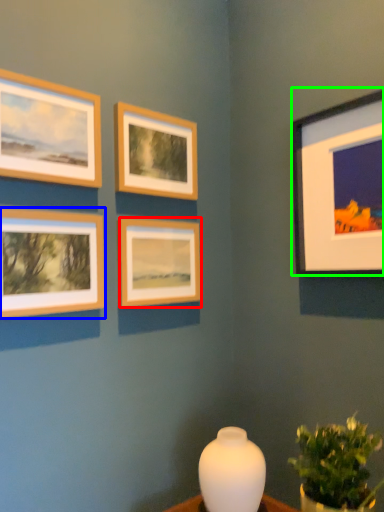
Question: Which is farther away from picture frame (highlighted by a red box)? picture frame (highlighted by a blue box) or picture frame (highlighted by a green box)?

Choices:
 (A) picture frame
 (B) picture frame

Answer: (B)